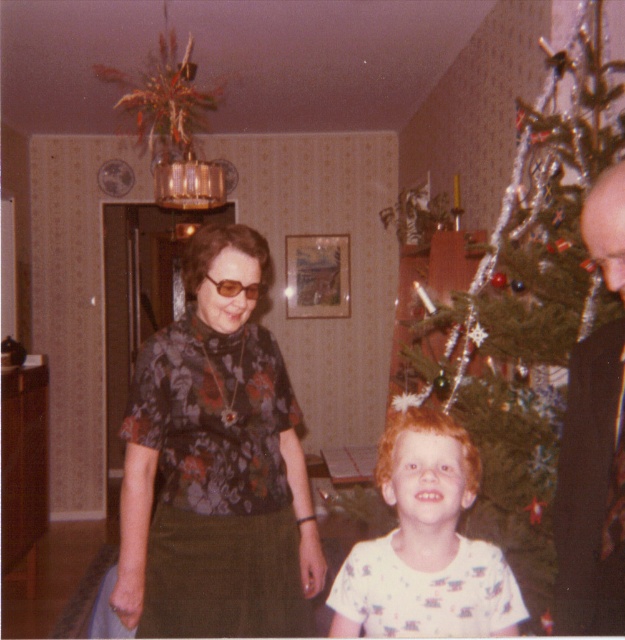
Question: Does green textured christmas tree at right come behind dark brown leather jacket at right?

Choices:
 (A) yes
 (B) no

Answer: (A)

Question: Is floral print blouse at center thinner than white cotton shirt at center?

Choices:
 (A) yes
 (B) no

Answer: (B)

Question: Can you confirm if green textured christmas tree at right is positioned above floral print blouse at center?

Choices:
 (A) yes
 (B) no

Answer: (A)

Question: Estimate the real-world distances between objects in this image. Which object is closer to the white cotton shirt at center?

Choices:
 (A) green textured christmas tree at right
 (B) floral print blouse at center

Answer: (B)

Question: Which object appears closest to the camera in this image?

Choices:
 (A) dark brown leather jacket at right
 (B) green textured christmas tree at right
 (C) floral print blouse at center

Answer: (A)

Question: Which of the following is the farthest from the observer?

Choices:
 (A) floral print blouse at center
 (B) dark brown leather jacket at right
 (C) green textured christmas tree at right
 (D) white cotton shirt at center

Answer: (C)